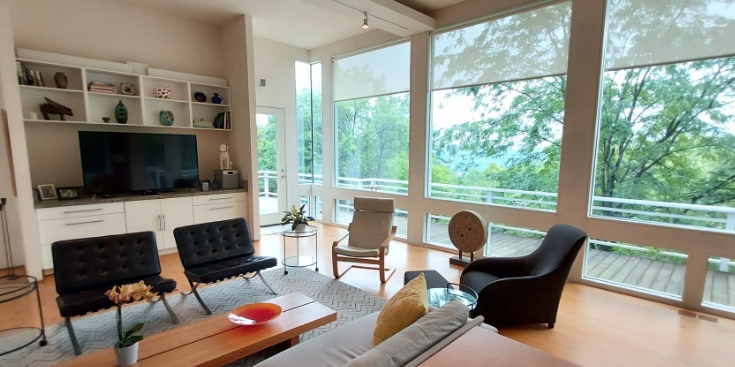
Locate an element on the screen. doorknob is located at coordinates (282, 176).